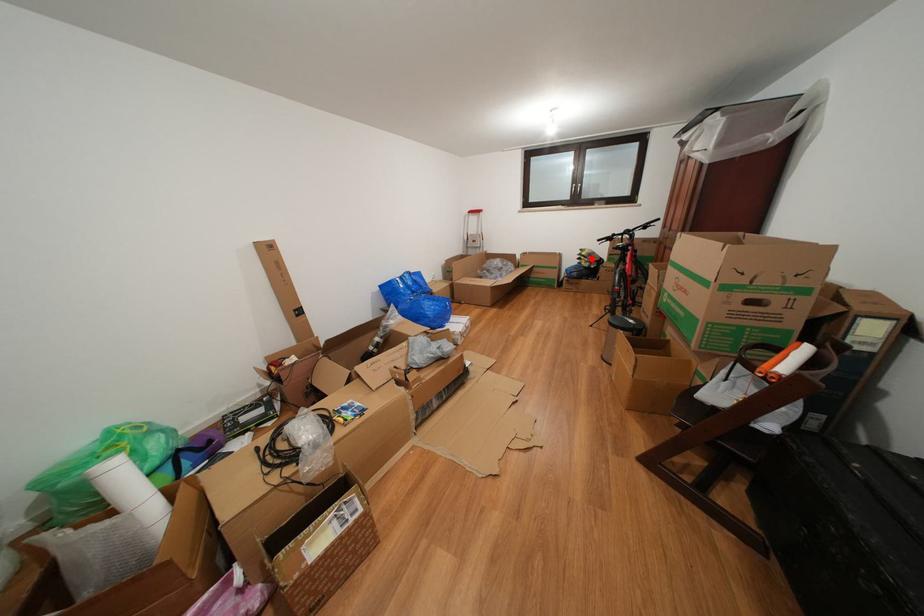
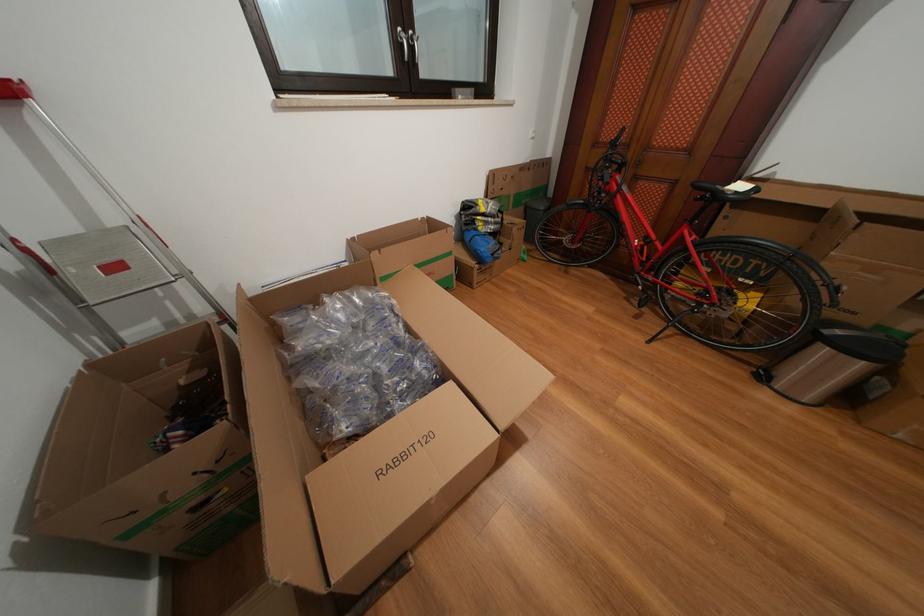
Question: I am providing you with two images of the same scene from different viewpoints. In image1, a red point is highlighted. Considering the same 3D point in image2, which of the following is correct?

Choices:
 (A) It is closer
 (B) It is farther

Answer: (B)